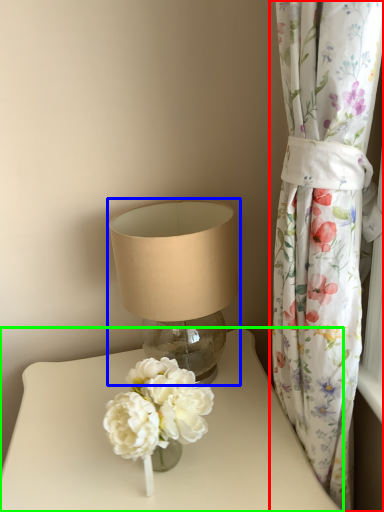
Question: Considering the real-world distances, which object is farthest from curtain (highlighted by a red box)? lamp (highlighted by a blue box) or table (highlighted by a green box)?

Choices:
 (A) lamp
 (B) table

Answer: (B)